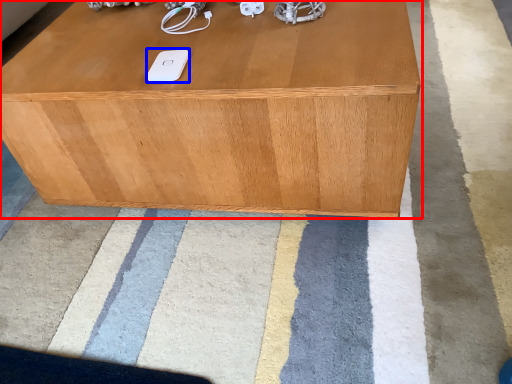
Question: Which point is closer to the camera, table (highlighted by a red box) or ipod (highlighted by a blue box)?

Choices:
 (A) table
 (B) ipod

Answer: (A)